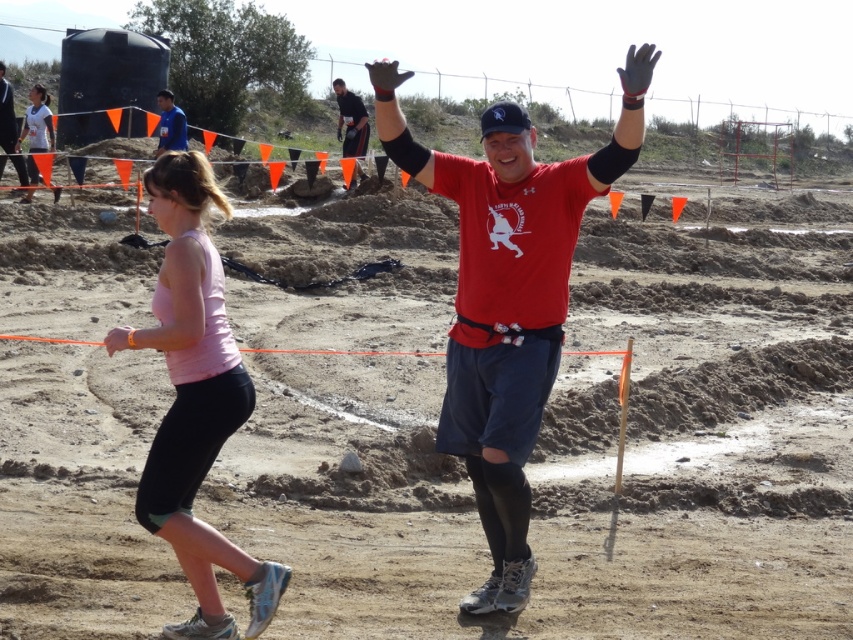
Does dirt at center have a larger size compared to matte blue shirt at upper left?

Correct, dirt at center is larger in size than matte blue shirt at upper left.

Between dirt at center and matte blue shirt at upper left, which one appears on the right side from the viewer's perspective?

dirt at center

Between point (749, 435) and point (180, 125), which one is positioned behind?

Point (180, 125)

Where is `dirt at center`? The width and height of the screenshot is (853, 640). dirt at center is located at coordinates (555, 426).

Describe the element at coordinates (38, 122) in the screenshot. I see `matte pink tank top at left` at that location.

Is matte pink tank top at left smaller than matte pink tank top at center?

Incorrect, matte pink tank top at left is not smaller in size than matte pink tank top at center.

Identify the location of matte pink tank top at left. (38, 122).

This screenshot has height=640, width=853. Describe the element at coordinates (9, 129) in the screenshot. I see `matte pink tank top at center` at that location.

Does matte pink tank top at center come in front of matte blue shirt at upper left?

Yes, matte pink tank top at center is closer to the viewer.

Who is more distant from viewer, (22, 176) or (161, 140)?

The point (161, 140) is behind.

The image size is (853, 640). Identify the location of matte pink tank top at center. (9, 129).